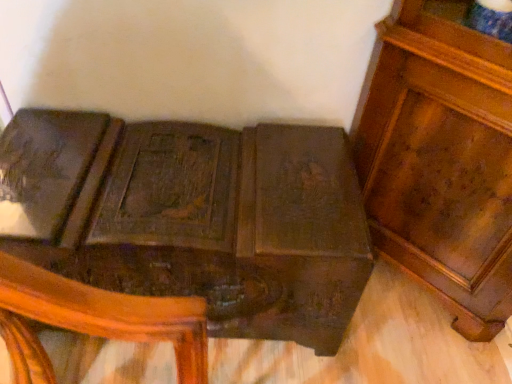
Question: Is glossy wood cabinet at upper right, which is the 1th furniture from right to left, in front of or behind dark wood carved trunk at center, the 2th furniture viewed from the right, in the image?

Choices:
 (A) front
 (B) behind

Answer: (A)

Question: Considering the positions of glossy wood cabinet at upper right, the second furniture when ordered from left to right, and dark wood carved trunk at center, the 2th furniture viewed from the right, in the image, is glossy wood cabinet at upper right, the second furniture when ordered from left to right, bigger or smaller than dark wood carved trunk at center, the 2th furniture viewed from the right,?

Choices:
 (A) big
 (B) small

Answer: (B)

Question: From the image's perspective, is glossy wood cabinet at upper right, the second furniture when ordered from left to right, located above or below dark wood carved trunk at center, which is the first furniture from left to right?

Choices:
 (A) above
 (B) below

Answer: (A)

Question: Is dark wood carved trunk at center, which is the first furniture from left to right, wider or thinner than glossy wood cabinet at upper right, the second furniture when ordered from left to right?

Choices:
 (A) thin
 (B) wide

Answer: (B)

Question: In the image, is dark wood carved trunk at center, which is the first furniture from left to right, positioned in front of or behind glossy wood cabinet at upper right, which is the 1th furniture from right to left?

Choices:
 (A) behind
 (B) front

Answer: (A)

Question: From the image's perspective, relative to glossy wood cabinet at upper right, which is the 1th furniture from right to left, is dark wood carved trunk at center, which is the first furniture from left to right, above or below?

Choices:
 (A) below
 (B) above

Answer: (A)

Question: Is dark wood carved trunk at center, the 2th furniture viewed from the right, bigger or smaller than glossy wood cabinet at upper right, the second furniture when ordered from left to right?

Choices:
 (A) big
 (B) small

Answer: (A)